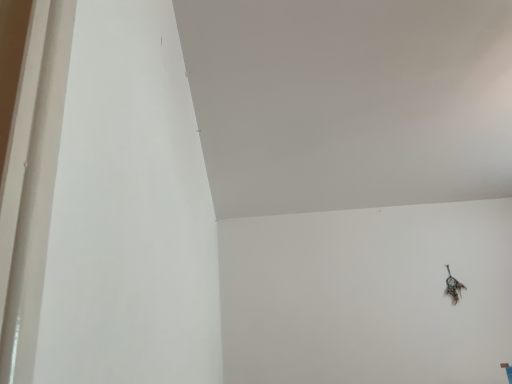
What do you see at coordinates (453, 287) in the screenshot? I see `metallic blue toy at lower right` at bounding box center [453, 287].

This screenshot has width=512, height=384. Identify the location of metallic blue toy at lower right. (453, 287).

Identify the location of metallic blue toy at lower right. (453, 287).